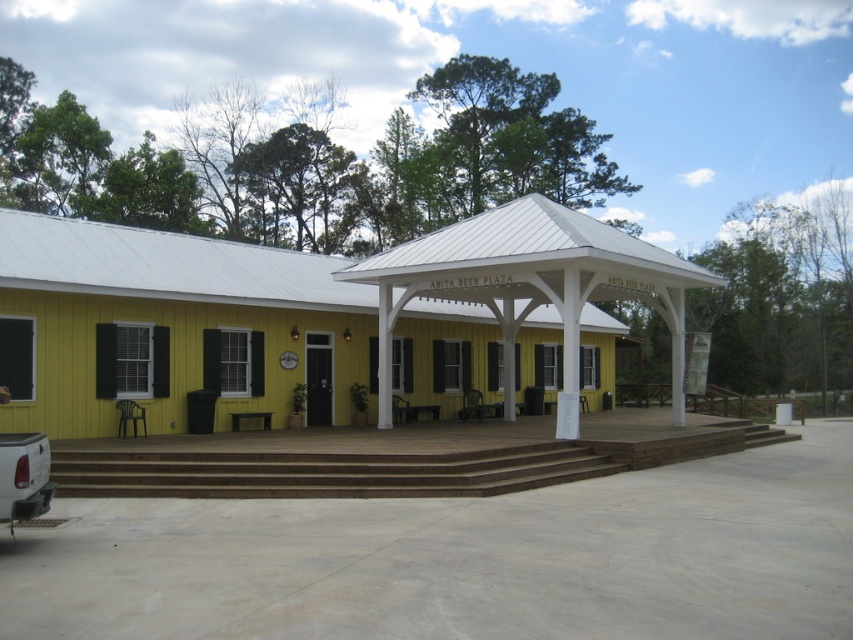
You are planning to place a long bench on the brown wooden porch at center and the brown wooden stairs at center. Based on their widths, which location would be more suitable for the bench?

The brown wooden porch at center has a greater width than the brown wooden stairs at center, so the bench would be more suitable on the brown wooden porch at center.

Consider the image. You are standing in front of the Abita Beer Plaza and want to reach the seating area on the brown wooden porch at center. The brown wooden stairs at center are in your way. Which direction should you move to go around the stairs and head towards the porch?

You should move to the right side of the brown wooden stairs at center since the brown wooden porch at center is located to the right of the stairs, allowing you to navigate around them towards the porch.